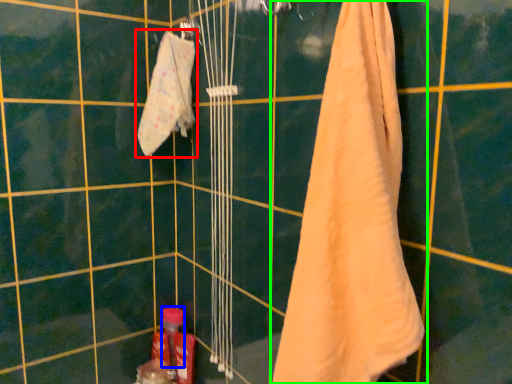
Question: Considering the real-world distances, which object is closest to towel (highlighted by a red box)? toiletry (highlighted by a blue box) or towel (highlighted by a green box).

Choices:
 (A) toiletry
 (B) towel

Answer: (B)